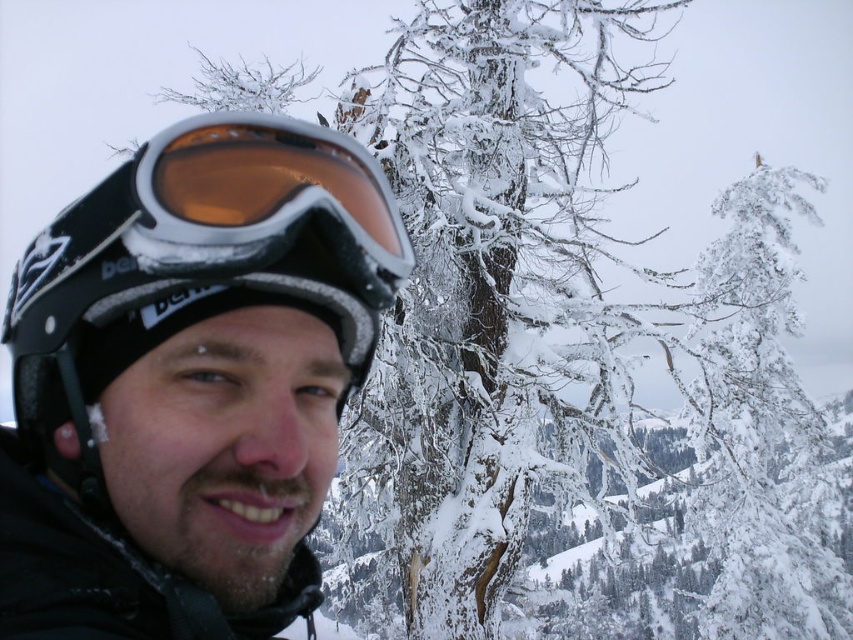
You are navigating a drone through the snowy landscape shown in the image. Your goal is to fly from point (x=73, y=538) to point (x=357, y=196). Since the trees in the background are heavily snowed, you must avoid flying too close to them. Given the spatial relationship between these two points, which point should you start your flight from to ensure you stay clear of the snowed trees?

You should start your flight from point (x=73, y=538) because it is closer to the viewer than point (x=357, y=196). Starting closer to the viewer allows you to navigate safely away from the snowed trees in the background.